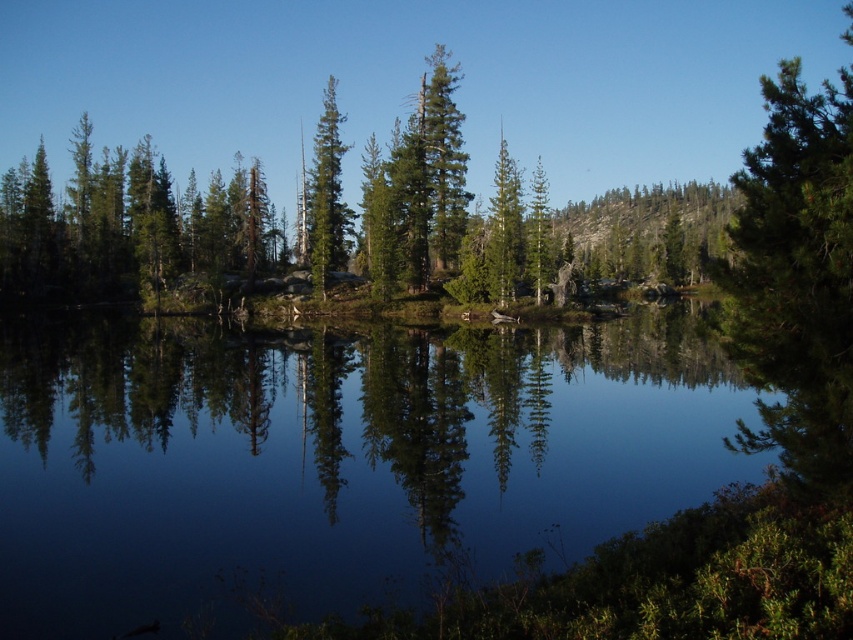
Is point (321, 529) more distant than point (801, 216)?

Yes, point (321, 529) is behind point (801, 216).

Find the location of `transparent water at center`. transparent water at center is located at coordinates (335, 461).

Locate an element on the screen. This screenshot has height=640, width=853. transparent water at center is located at coordinates (335, 461).

Consider the image. Does transparent water at center appear on the left side of green matte tree at center?

No, transparent water at center is not to the left of green matte tree at center.

Who is positioned more to the right, transparent water at center or green matte tree at center?

From the viewer's perspective, transparent water at center appears more on the right side.

Who is more distant from viewer, (442, 561) or (321, 179)?

The point (321, 179) is behind.

This screenshot has width=853, height=640. Identify the location of transparent water at center. [x=335, y=461].

Is green textured pine tree at right closer to the viewer compared to green matte tree at center?

Yes, green textured pine tree at right is in front of green matte tree at center.

Is green textured pine tree at right below green matte tree at center?

Yes, green textured pine tree at right is below green matte tree at center.

This screenshot has height=640, width=853. I want to click on green textured pine tree at right, so click(798, 276).